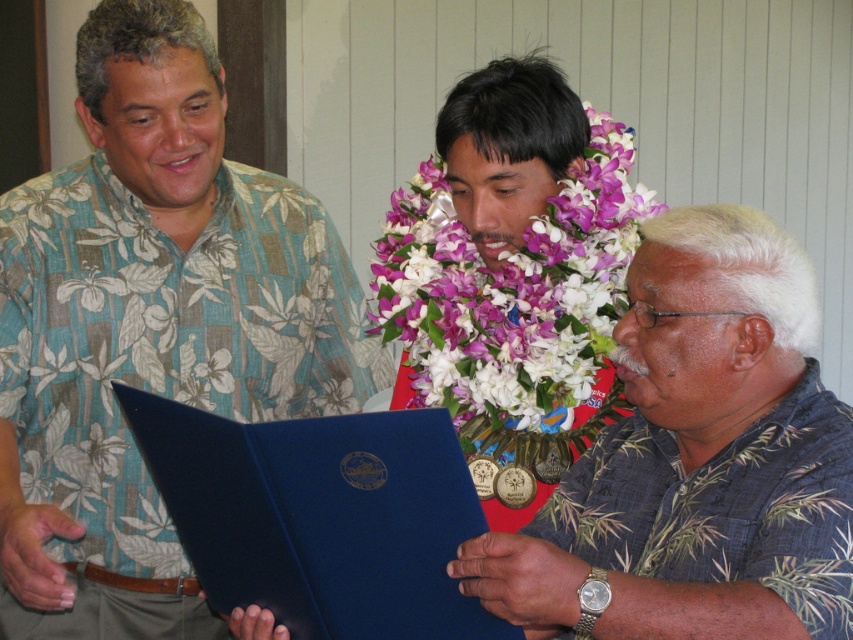
Locate an element on the screen. This screenshot has width=853, height=640. floral print shirt at left is located at coordinates (151, 328).

Where is `floral print shirt at left`? This screenshot has width=853, height=640. floral print shirt at left is located at coordinates (151, 328).

Which is in front, point (3, 420) or point (511, 541)?

Positioned in front is point (511, 541).

How much distance is there between floral print shirt at left and blue fabric folder at center?

floral print shirt at left is 21.77 inches from blue fabric folder at center.

Who is more distant from viewer, (76, 337) or (534, 595)?

The point (76, 337) is more distant.

In order to click on floral print shirt at left in this screenshot , I will do `click(151, 328)`.

Which is above, blue leather book at center or purple fabric lei at center?

purple fabric lei at center is above.

Where is `blue leather book at center`? blue leather book at center is located at coordinates (320, 516).

Does point (418, 410) lie behind point (515, 435)?

No.

Locate an element on the screen. The width and height of the screenshot is (853, 640). blue leather book at center is located at coordinates (320, 516).